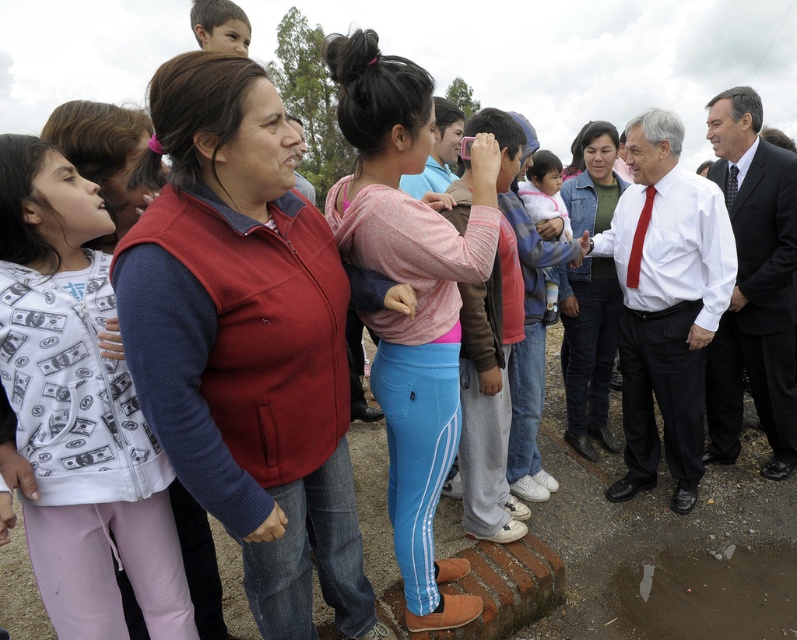
Question: Is pink fabric shirt at center bigger than red silk tie at center-right?

Choices:
 (A) yes
 (B) no

Answer: (A)

Question: Considering the real-world distances, which object is closest to the red silk tie at right?

Choices:
 (A) dark suit at right
 (B) matte red vest at center
 (C) matte fleece vest at center
 (D) matte white shirt at center

Answer: (A)

Question: Which is nearer to the dark suit at right?

Choices:
 (A) matte green sweater at center
 (B) matte red vest at center
 (C) red silk tie at center-right

Answer: (A)

Question: Which object is the closest to the pink fabric shirt at center?

Choices:
 (A) matte red vest at center
 (B) matte fleece vest at center
 (C) red silk tie at center-right

Answer: (A)

Question: In this image, where is matte fleece vest at center located relative to pink fabric shirt at center?

Choices:
 (A) below
 (B) above

Answer: (A)

Question: Can you confirm if red silk tie at center-right is positioned to the right of red silk tie at right?

Choices:
 (A) yes
 (B) no

Answer: (B)